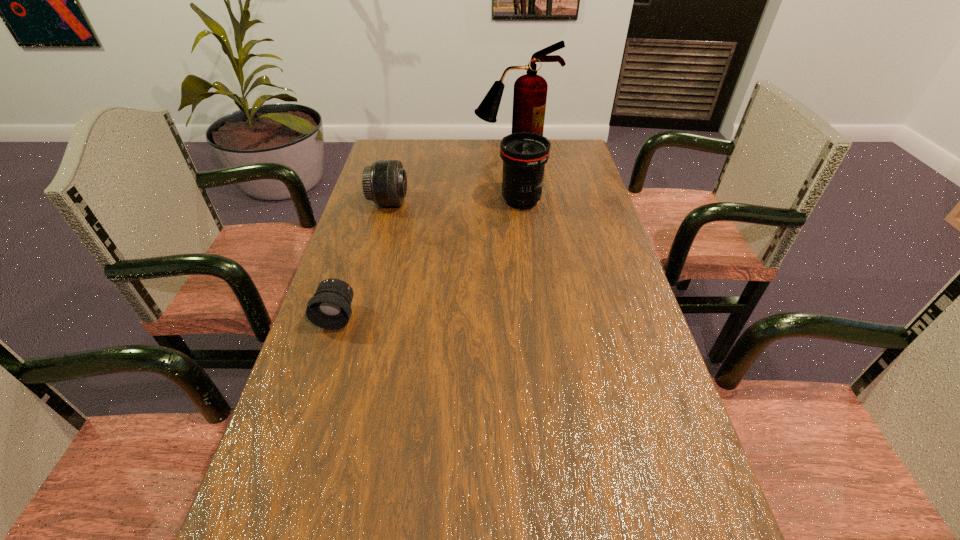
Locate an element on the screen. the farthest object is located at coordinates (530, 90).

Find the location of a particular element. fire extinguisher is located at coordinates (530, 90).

Identify the location of the tallest telephoto lens. This screenshot has height=540, width=960. (524, 155).

Find the location of `the rightmost telephoto lens`. the rightmost telephoto lens is located at coordinates (524, 155).

This screenshot has width=960, height=540. Identify the location of the second shortest object. (385, 182).

At what (x,y) coordinates should I click in order to perform the action: click on the nearest telephoto lens. Please return your answer as a coordinate pair (x, y). Looking at the image, I should click on click(330, 308).

Identify the location of the shortest object. The height and width of the screenshot is (540, 960). (330, 308).

I want to click on free spot located 0.060m at the nozzle of the tallest object, so click(516, 165).

The image size is (960, 540). Find the location of `free space located on the right of the rightmost telephoto lens`. free space located on the right of the rightmost telephoto lens is located at coordinates (588, 201).

At what (x,y) coordinates should I click in order to perform the action: click on vacant space located on the front-facing side of the second shortest telephoto lens. Please return your answer as a coordinate pair (x, y). The image size is (960, 540). Looking at the image, I should click on (494, 202).